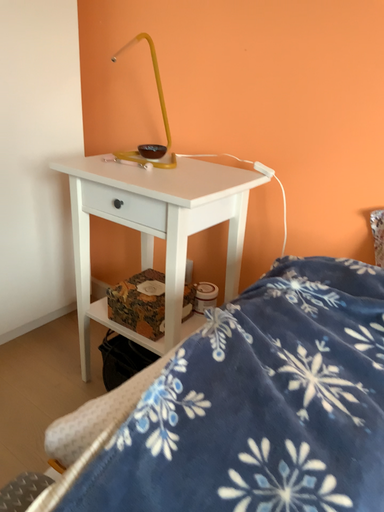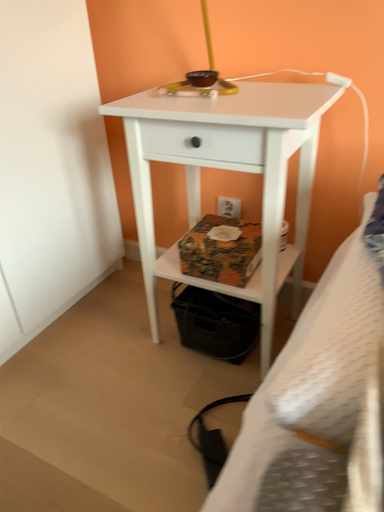
Question: How did the camera likely rotate when shooting the video?

Choices:
 (A) rotated downward
 (B) rotated upward

Answer: (A)